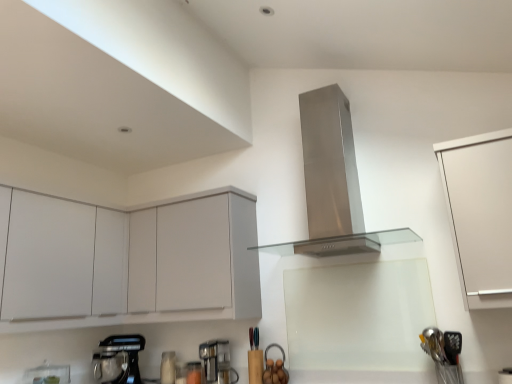
Question: Can you confirm if white matte cabinet at upper left, acting as the 2th cabinetry starting from the right, is bigger than stainless steel range hood at center?

Choices:
 (A) yes
 (B) no

Answer: (B)

Question: Considering the relative sizes of white matte cabinet at upper left, acting as the 2th cabinetry starting from the right, and stainless steel range hood at center in the image provided, is white matte cabinet at upper left, acting as the 2th cabinetry starting from the right, thinner than stainless steel range hood at center?

Choices:
 (A) yes
 (B) no

Answer: (A)

Question: Is white matte cabinet at upper left, acting as the 2th cabinetry starting from the right, with stainless steel range hood at center?

Choices:
 (A) no
 (B) yes

Answer: (A)

Question: Is stainless steel range hood at center at the back of white matte cabinet at upper left, acting as the 2th cabinetry starting from the right?

Choices:
 (A) no
 (B) yes

Answer: (A)

Question: Is the depth of white matte cabinet at upper left, which appears as the second cabinetry when viewed from the left, greater than that of stainless steel range hood at center?

Choices:
 (A) no
 (B) yes

Answer: (B)

Question: From the image's perspective, is stainless steel range hood at center above or below satin silver utensils at lower right?

Choices:
 (A) above
 (B) below

Answer: (A)

Question: From a real-world perspective, is stainless steel range hood at center above or below satin silver utensils at lower right?

Choices:
 (A) above
 (B) below

Answer: (A)

Question: Is stainless steel range hood at center bigger or smaller than satin silver utensils at lower right?

Choices:
 (A) small
 (B) big

Answer: (B)

Question: Relative to satin silver utensils at lower right, is stainless steel range hood at center in front or behind?

Choices:
 (A) front
 (B) behind

Answer: (B)

Question: Considering the relative positions of white matte cabinet at left, which is the 3th cabinetry in right-to-left order, and metallic gray coffee machine at lower center in the image provided, is white matte cabinet at left, which is the 3th cabinetry in right-to-left order, to the left or to the right of metallic gray coffee machine at lower center?

Choices:
 (A) right
 (B) left

Answer: (B)

Question: Choose the correct answer: Is white matte cabinet at left, marked as the first cabinetry in a left-to-right arrangement, inside metallic gray coffee machine at lower center or outside it?

Choices:
 (A) outside
 (B) inside

Answer: (A)

Question: Relative to metallic gray coffee machine at lower center, is white matte cabinet at left, marked as the first cabinetry in a left-to-right arrangement, in front or behind?

Choices:
 (A) behind
 (B) front

Answer: (B)

Question: Considering the positions of white matte cabinet at left, marked as the first cabinetry in a left-to-right arrangement, and metallic gray coffee machine at lower center in the image, is white matte cabinet at left, marked as the first cabinetry in a left-to-right arrangement, taller or shorter than metallic gray coffee machine at lower center?

Choices:
 (A) short
 (B) tall

Answer: (B)

Question: From a real-world perspective, is stainless steel range hood at center positioned above or below white matte cabinet at right, the 1th cabinetry from the right?

Choices:
 (A) above
 (B) below

Answer: (A)

Question: Does point (332, 91) appear closer or farther from the camera than point (480, 231)?

Choices:
 (A) closer
 (B) farther

Answer: (B)